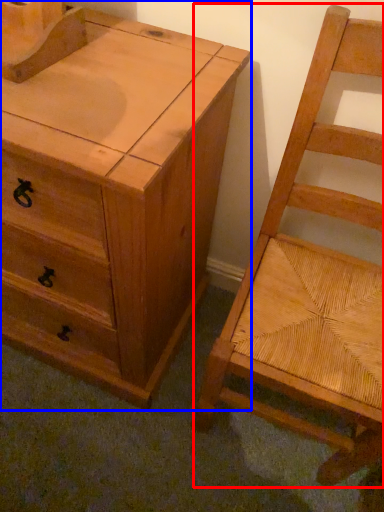
Question: Among these objects, which one is nearest to the camera, chair (highlighted by a red box) or chest of drawers (highlighted by a blue box)?

Choices:
 (A) chair
 (B) chest of drawers

Answer: (A)